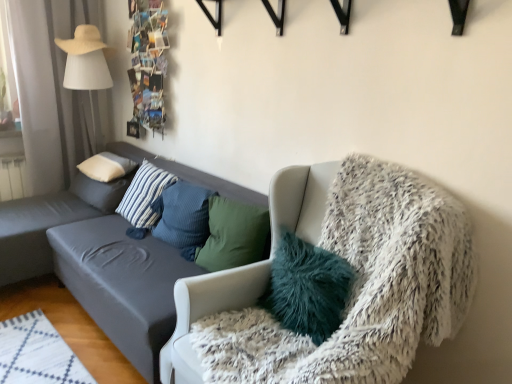
Question: Which direction should I rotate to look at blue striped pillow at center, the third pillow viewed from the left?

Choices:
 (A) right
 (B) left

Answer: (B)

Question: From a real-world perspective, does dark gray fabric couch at left stand above white fluffy chair at right?

Choices:
 (A) yes
 (B) no

Answer: (B)

Question: Considering the relative sizes of dark gray fabric couch at left and white fluffy chair at right in the image provided, is dark gray fabric couch at left shorter than white fluffy chair at right?

Choices:
 (A) no
 (B) yes

Answer: (B)

Question: Considering the relative sizes of dark gray fabric couch at left and white fluffy chair at right in the image provided, is dark gray fabric couch at left bigger than white fluffy chair at right?

Choices:
 (A) yes
 (B) no

Answer: (A)

Question: Is dark gray fabric couch at left with white fluffy chair at right?

Choices:
 (A) yes
 (B) no

Answer: (B)

Question: Considering the relative positions of dark gray fabric couch at left and white fluffy chair at right in the image provided, is dark gray fabric couch at left to the right of white fluffy chair at right from the viewer's perspective?

Choices:
 (A) yes
 (B) no

Answer: (B)

Question: From the image's perspective, is dark gray fabric couch at left above white fluffy chair at right?

Choices:
 (A) no
 (B) yes

Answer: (B)

Question: Is blue striped pillow at center, which is counted as the third pillow, starting from the right, shorter than white soft pillow at upper left, the 1th pillow when ordered from left to right?

Choices:
 (A) no
 (B) yes

Answer: (A)

Question: From the image's perspective, is blue striped pillow at center, which is counted as the third pillow, starting from the right, located beneath white soft pillow at upper left, arranged as the fifth pillow when viewed from the right?

Choices:
 (A) no
 (B) yes

Answer: (B)

Question: Is blue striped pillow at center, the third pillow viewed from the left, positioned far away from white soft pillow at upper left, arranged as the fifth pillow when viewed from the right?

Choices:
 (A) yes
 (B) no

Answer: (B)

Question: Does blue striped pillow at center, the third pillow viewed from the left, appear on the right side of white soft pillow at upper left, the 1th pillow when ordered from left to right?

Choices:
 (A) yes
 (B) no

Answer: (A)

Question: Considering the relative sizes of blue striped pillow at center, the third pillow viewed from the left, and white soft pillow at upper left, the 1th pillow when ordered from left to right, in the image provided, is blue striped pillow at center, the third pillow viewed from the left, bigger than white soft pillow at upper left, the 1th pillow when ordered from left to right,?

Choices:
 (A) no
 (B) yes

Answer: (A)

Question: Is blue striped pillow at center, which is counted as the third pillow, starting from the right, positioned beyond the bounds of white soft pillow at upper left, arranged as the fifth pillow when viewed from the right?

Choices:
 (A) yes
 (B) no

Answer: (A)

Question: From the image's perspective, is blue textured pillow at center, the second pillow when ordered from right to left, on top of dark gray fabric couch at left?

Choices:
 (A) yes
 (B) no

Answer: (A)